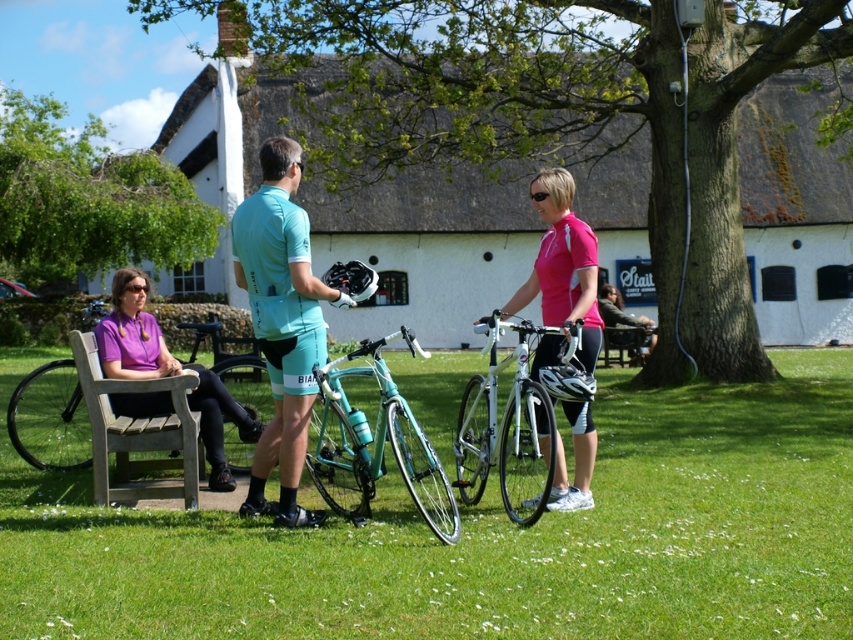
Locate an element on the screen. This screenshot has width=853, height=640. matte teal bicycle at center is located at coordinates (531, 372).

The width and height of the screenshot is (853, 640). Identify the location of matte teal bicycle at center. pyautogui.click(x=531, y=372).

The image size is (853, 640). I want to click on matte teal bicycle at center, so click(x=531, y=372).

Does matte teal bicycle at center appear under pink matte jersey at center?

Incorrect, matte teal bicycle at center is not positioned below pink matte jersey at center.

Can you confirm if matte teal bicycle at center is smaller than pink matte jersey at center?

Yes.

The image size is (853, 640). Describe the element at coordinates (531, 372) in the screenshot. I see `matte teal bicycle at center` at that location.

The height and width of the screenshot is (640, 853). In order to click on matte teal bicycle at center in this screenshot , I will do `click(531, 372)`.

At what (x,y) coordinates should I click in order to perform the action: click on teal fabric jersey at center. Please return your answer as a coordinate pair (x, y). Looking at the image, I should click on (282, 323).

Does teal fabric jersey at center have a smaller size compared to teal glossy bicycle at center?

Indeed, teal fabric jersey at center has a smaller size compared to teal glossy bicycle at center.

Identify the location of teal fabric jersey at center. This screenshot has height=640, width=853. (282, 323).